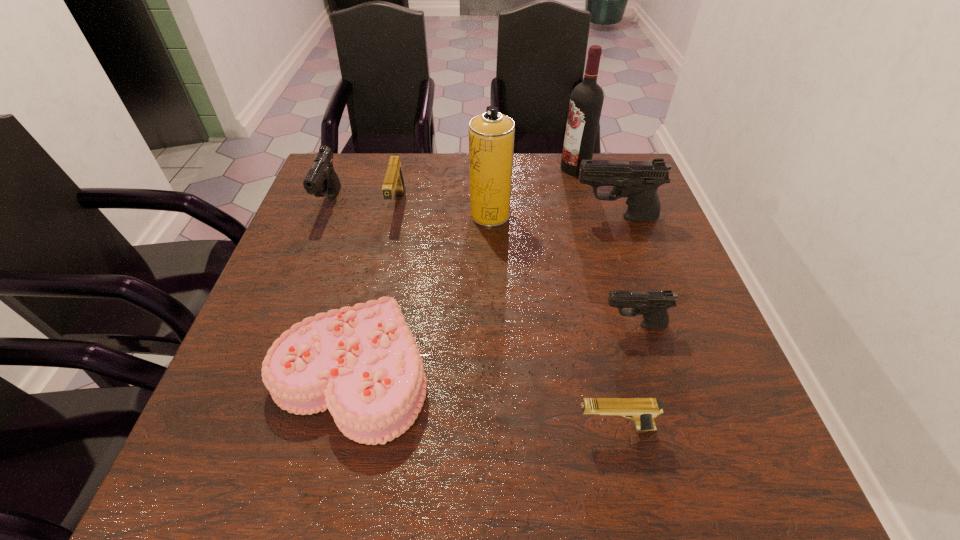
Identify the location of free space located 0.130m at the barrel of the tallest pistol. (522, 218).

Where is `vacant area situated at the barrel of the leftmost pistol`? The height and width of the screenshot is (540, 960). vacant area situated at the barrel of the leftmost pistol is located at coordinates (291, 304).

Find the location of a particular element. free space located at the barrel of the farther tan pistol is located at coordinates (379, 287).

The width and height of the screenshot is (960, 540). Find the location of `vacant region located at the barrel of the smallest black pistol`. vacant region located at the barrel of the smallest black pistol is located at coordinates (503, 326).

I want to click on free space located at the barrel of the smallest black pistol, so pyautogui.click(x=538, y=326).

The height and width of the screenshot is (540, 960). Identify the location of vacant point located 0.090m at the barrel of the smallest black pistol. click(557, 326).

Identify the location of vacant region located 0.270m at the barrel of the nearer tan pistol. (417, 427).

You are a GUI agent. You are given a task and a screenshot of the screen. Output one action in this format:
    pyautogui.click(x=<x>, y=<y>)
    Task: Click on the vacant space located 0.280m at the barrel of the nearer tan pistol
    
    Given the screenshot: What is the action you would take?
    pyautogui.click(x=411, y=427)

The image size is (960, 540). Identify the location of vacant space situated at the barrel of the nearer tan pistol. (534, 427).

Where is `vacant area situated 0.060m on the back of the cake`? This screenshot has height=540, width=960. vacant area situated 0.060m on the back of the cake is located at coordinates (370, 294).